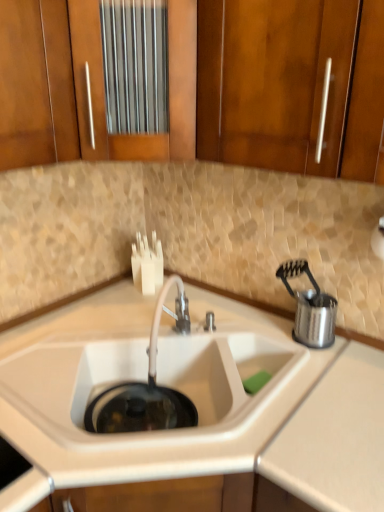
The image size is (384, 512). What are the coordinates of `vacant space underneath wooden cabinet at upper left, the first cabinetry viewed from the left (from a real-world perspective)` in the screenshot? It's located at (26, 333).